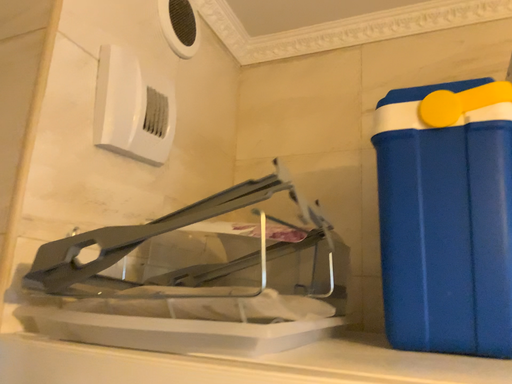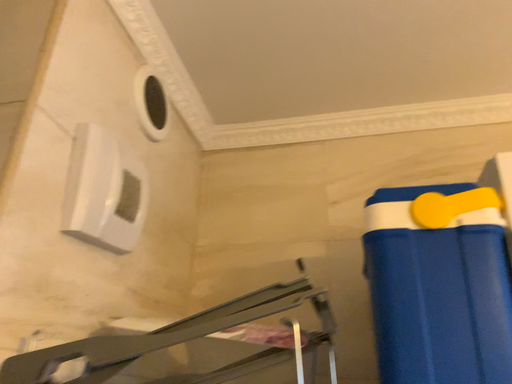
Question: Which way did the camera rotate in the video?

Choices:
 (A) rotated left
 (B) rotated right

Answer: (B)